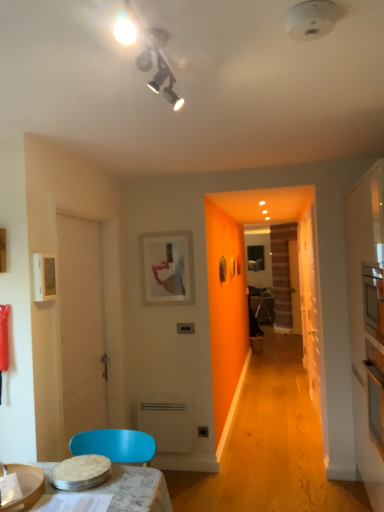
Question: From the image's perspective, is white matte door at left on transparent glass door at right?

Choices:
 (A) yes
 (B) no

Answer: (A)

Question: Is white matte door at left oriented away from transparent glass door at right?

Choices:
 (A) yes
 (B) no

Answer: (B)

Question: From a real-world perspective, does white matte door at left stand above transparent glass door at right?

Choices:
 (A) no
 (B) yes

Answer: (B)

Question: Is the surface of white matte door at left in direct contact with transparent glass door at right?

Choices:
 (A) no
 (B) yes

Answer: (A)

Question: Is white matte door at left positioned beyond the bounds of transparent glass door at right?

Choices:
 (A) yes
 (B) no

Answer: (A)

Question: Is white matte door at left positioned in front of transparent glass door at right?

Choices:
 (A) yes
 (B) no

Answer: (A)

Question: Is white plastic radiator at lower center at the back of transparent glass door at right?

Choices:
 (A) no
 (B) yes

Answer: (A)

Question: Is transparent glass door at right further to the viewer compared to white plastic radiator at lower center?

Choices:
 (A) no
 (B) yes

Answer: (A)

Question: Considering the relative sizes of transparent glass door at right and white plastic radiator at lower center in the image provided, is transparent glass door at right taller than white plastic radiator at lower center?

Choices:
 (A) yes
 (B) no

Answer: (A)

Question: Is transparent glass door at right next to white plastic radiator at lower center?

Choices:
 (A) no
 (B) yes

Answer: (A)

Question: Can you confirm if transparent glass door at right is bigger than white plastic radiator at lower center?

Choices:
 (A) yes
 (B) no

Answer: (A)

Question: Considering the relative sizes of transparent glass door at right and white plastic radiator at lower center in the image provided, is transparent glass door at right thinner than white plastic radiator at lower center?

Choices:
 (A) yes
 (B) no

Answer: (A)

Question: Is white plastic radiator at lower center at the back of white glossy microwave at right?

Choices:
 (A) no
 (B) yes

Answer: (A)